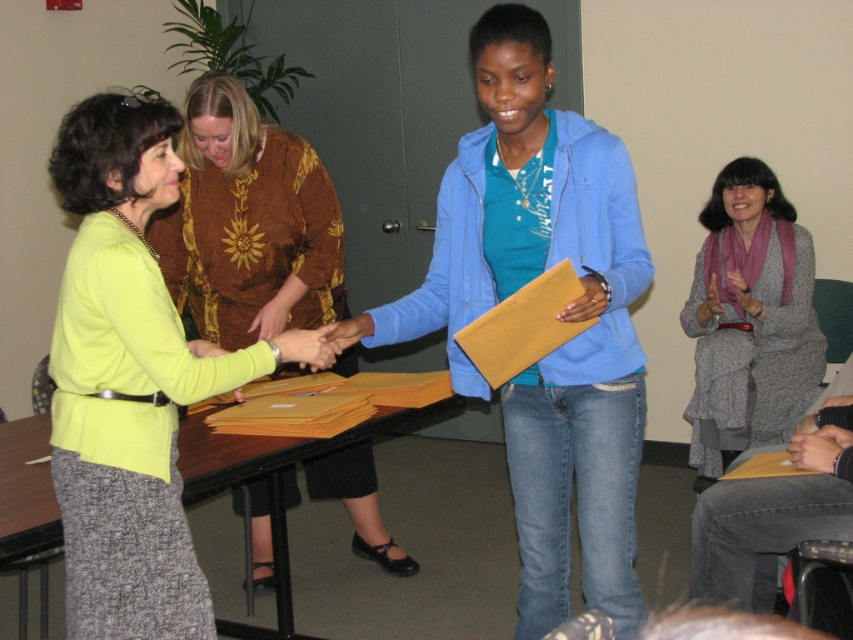
Based on the photo, who is lower down, blue matte jacket at center or matte yellow sweater at center?

blue matte jacket at center is lower down.

Is blue matte jacket at center smaller than matte yellow sweater at center?

No.

This screenshot has height=640, width=853. Find the location of `blue matte jacket at center`. blue matte jacket at center is located at coordinates (560, 317).

The image size is (853, 640). What do you see at coordinates (248, 225) in the screenshot?
I see `matte yellow sweater at center` at bounding box center [248, 225].

Where is `matte yellow sweater at center`? matte yellow sweater at center is located at coordinates 248,225.

The image size is (853, 640). In order to click on matte yellow sweater at center in this screenshot , I will do `click(248, 225)`.

Does point (300, 305) come closer to viewer compared to point (7, 451)?

No.

Find the location of a particular element. The height and width of the screenshot is (640, 853). matte yellow sweater at center is located at coordinates (248, 225).